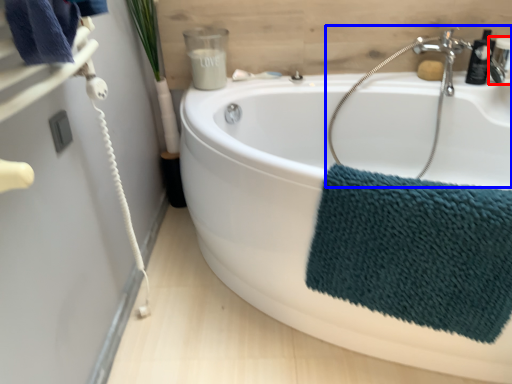
Question: Which of the following is the farthest to the observer, plumbing fixture (highlighted by a red box) or sink (highlighted by a blue box)?

Choices:
 (A) plumbing fixture
 (B) sink

Answer: (A)